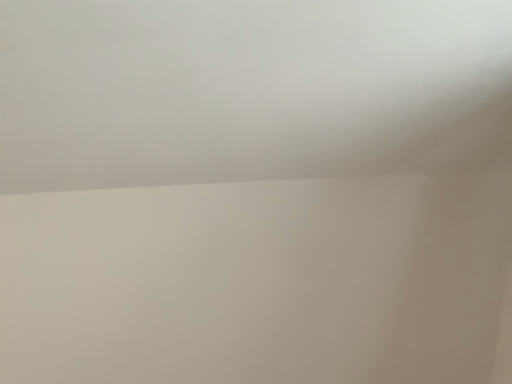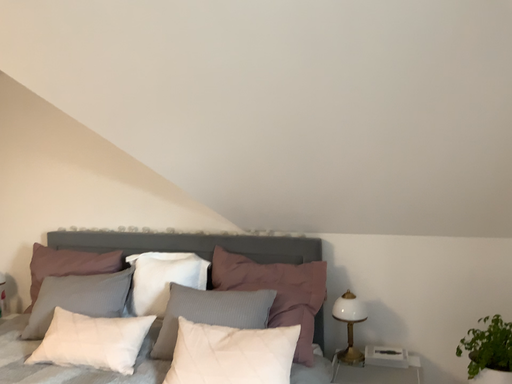
Question: Which way did the camera rotate in the video?

Choices:
 (A) rotated upward
 (B) rotated downward

Answer: (B)